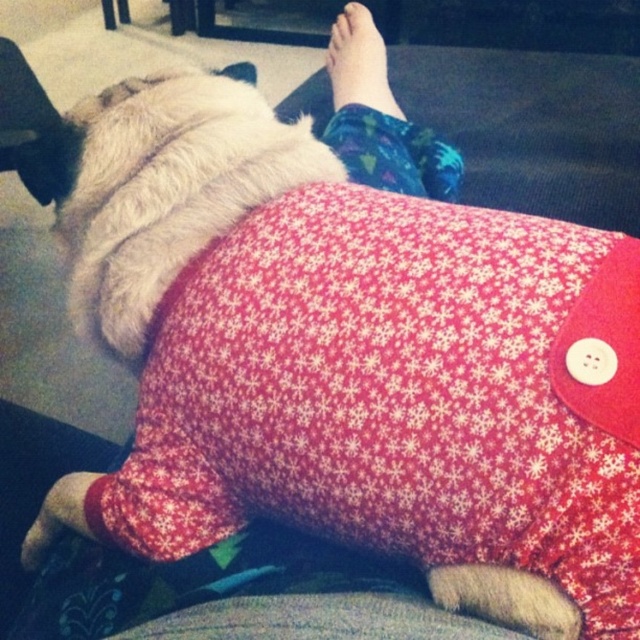
You are a dog wearing a red sweater and want to rest your head on the red fabric pillow at center or the skinny bare foot at upper center. Which one can you comfortably rest your head on based on their sizes?

The red fabric pillow at center is bigger than the skinny bare foot at upper center, so the dog can comfortably rest its head on the red fabric pillow at center.

You are a dog wearing a red sweater with white snowflakes. You want to rest your head on a soft pillow. The red fabric pillow at center is located at point (397, 394). Can you reach it from your current position?

The red fabric pillow at center is located at point (397, 394), so yes, the dog can reach it from its current position as the pillow is within the dog s reachable area.

You are a dog wearing a red sweater and want to rest your head on the red fabric pillow at center and the skinny bare foot at upper center. Which one is on the left side?

The red fabric pillow at center is positioned on the left side of the skinny bare foot at upper center, so the red fabric pillow at center is on the left side.